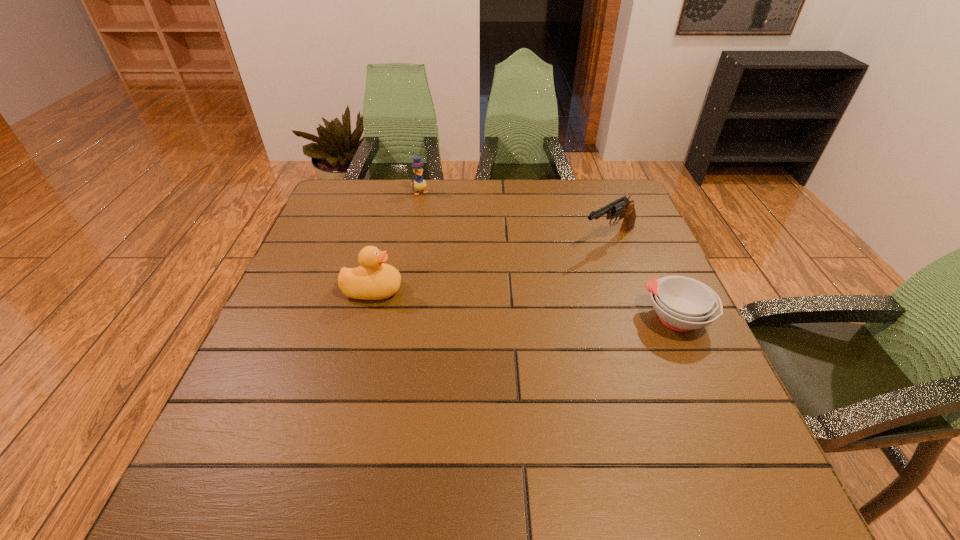
Find the location of a particular element. This screenshot has height=540, width=960. free region located 0.070m on the face of the farthest object, where the monocle is placed is located at coordinates (430, 207).

Find the location of a particular element. blank space located on the face of the farthest object, where the monocle is placed is located at coordinates (459, 253).

Locate an element on the screen. This screenshot has height=540, width=960. object situated at the far edge is located at coordinates (419, 184).

Image resolution: width=960 pixels, height=540 pixels. I want to click on object located at the left edge, so click(x=374, y=280).

You are a GUI agent. You are given a task and a screenshot of the screen. Output one action in this format:
    pyautogui.click(x=<x>, y=<y>)
    Task: Click on the soup bowl that is at the right edge
    This screenshot has width=960, height=540.
    Given the screenshot: What is the action you would take?
    pyautogui.click(x=682, y=303)

This screenshot has height=540, width=960. I want to click on gun located at the right edge, so click(622, 206).

In the image, there is a desktop. Identify the location of vacant space at the far edge. The width and height of the screenshot is (960, 540). (525, 192).

Locate an element on the screen. The image size is (960, 540). free region at the near edge of the desktop is located at coordinates (463, 433).

Locate an element on the screen. free region at the left edge of the desktop is located at coordinates (358, 229).

Locate an element on the screen. free space at the right edge is located at coordinates (623, 245).